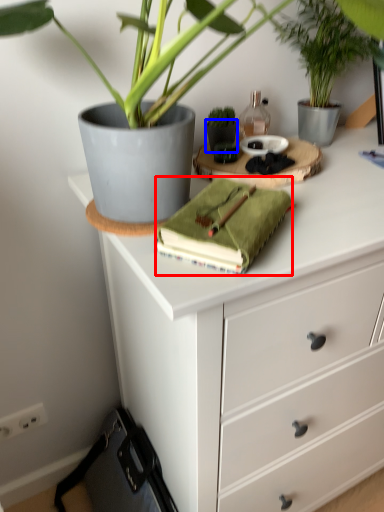
Question: Which of the following is the closest to the observer, journal (highlighted by a red box) or flowerpot (highlighted by a blue box)?

Choices:
 (A) journal
 (B) flowerpot

Answer: (A)